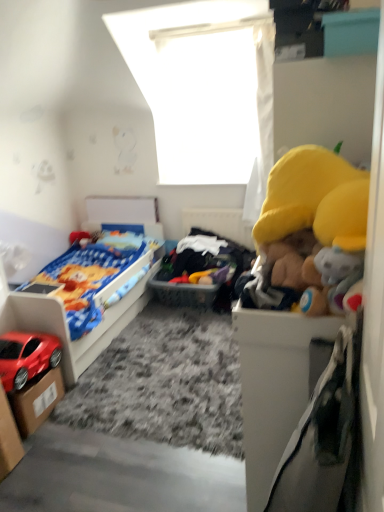
The height and width of the screenshot is (512, 384). What are the coordinates of `free spot above white fabric at upper center (from a real-world perspective)` in the screenshot? It's located at (206, 27).